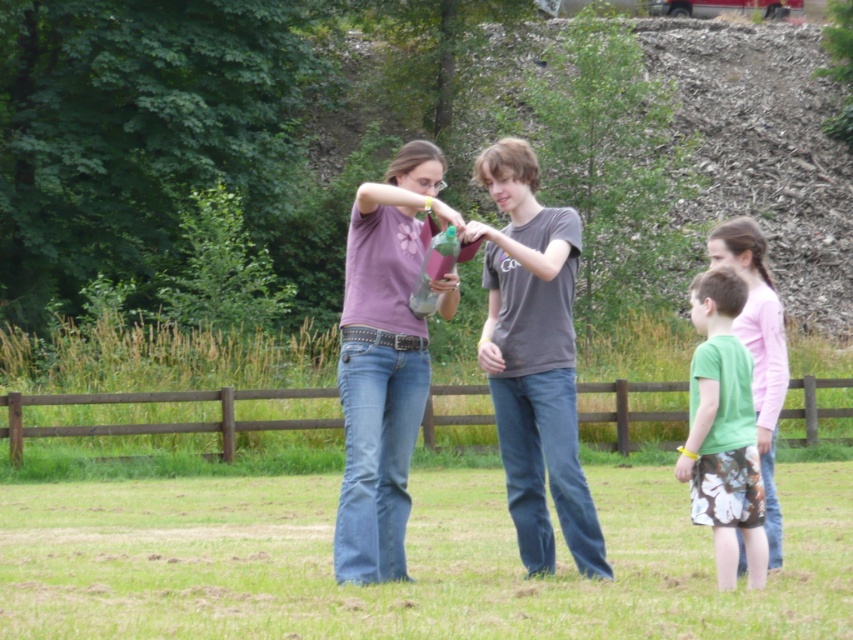
You are standing at point A, which is at coordinate point (543,380), and you want to walk to point B, which is at coordinate point (753,308). Which direction should you move to get closer to point B?

You should move backward because point A is in front of point B, so moving backward from point A will bring you closer to point B.

You are a photographer trying to capture a photo of the gray cotton shirt at center and the green fabric shorts at lower right. To ensure both are in the frame, should you adjust your camera to the left or right side?

The gray cotton shirt at center is positioned on the left side of green fabric shorts at lower right, so you should adjust your camera to the left to include both in the frame.